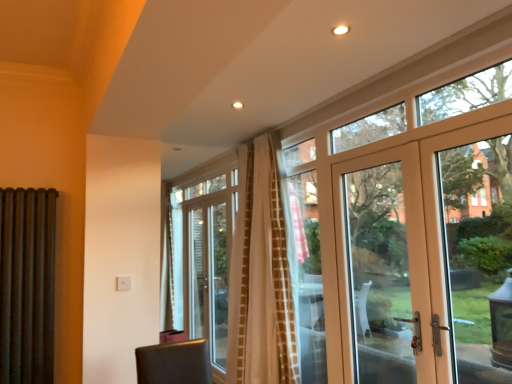
Question: From a real-world perspective, is clear glass door at upper right physically located above or below white textured curtain at center?

Choices:
 (A) above
 (B) below

Answer: (A)

Question: In the image, is clear glass door at upper right on the left side or the right side of white textured curtain at center?

Choices:
 (A) left
 (B) right

Answer: (B)

Question: Which is farther from the rusty metal radiator at left?

Choices:
 (A) white textured curtain at center
 (B) matte white door at right
 (C) clear glass door at upper right

Answer: (B)

Question: Which object is positioned closest to the clear glass door at upper right?

Choices:
 (A) rusty metal radiator at left
 (B) white textured curtain at center
 (C) matte white door at right

Answer: (C)